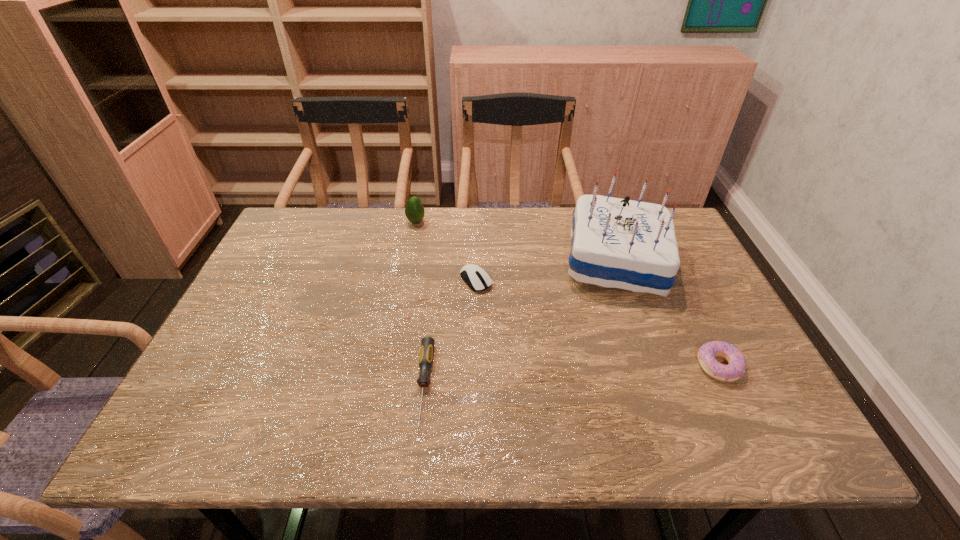
Identify the location of free area in between the birthday cake and the second object from left to right. This screenshot has width=960, height=540. (519, 323).

What are the coordinates of `free point between the tallest object and the shortest object` in the screenshot? It's located at coord(519,323).

Identify the location of vacant space in between the leftmost object and the tallest object. The height and width of the screenshot is (540, 960). (516, 241).

Locate an element on the screen. This screenshot has width=960, height=540. object identified as the third closest to the tallest object is located at coordinates (427, 344).

Identify which object is the second nearest to the screwdriver. Please provide its 2D coordinates. Your answer should be formatted as a tuple, i.e. [(x, y)], where the tuple contains the x and y coordinates of a point satisfying the conditions above.

[(616, 243)]

What are the coordinates of `vacant space that satisfies the following two spatial constraints: 1. on the front side of the doughnut; 2. on the right side of the avocado` in the screenshot? It's located at pos(389,366).